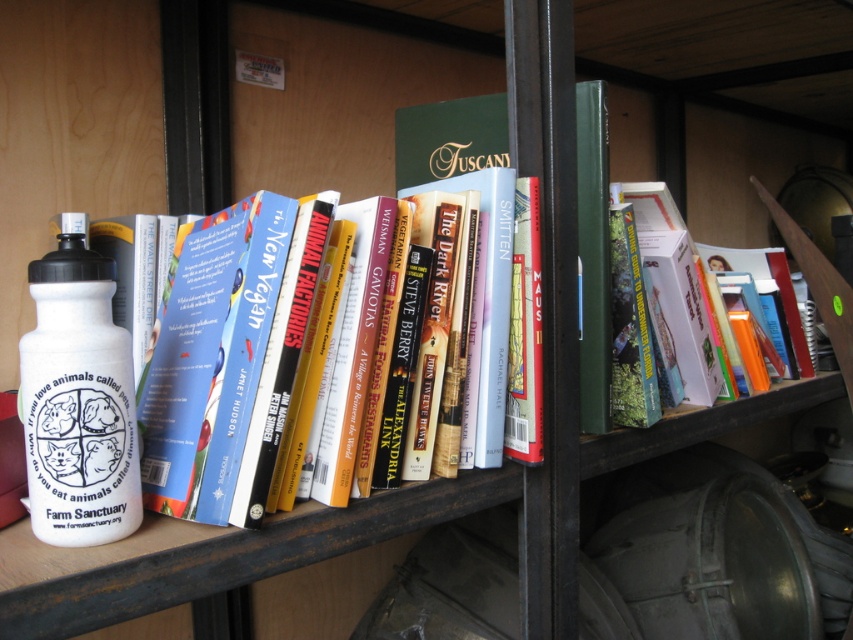
Who is lower down, white matte water bottle at left or green hardcover book at center?

white matte water bottle at left is lower down.

Who is positioned more to the left, white matte water bottle at left or green hardcover book at center?

white matte water bottle at left is more to the left.

Identify the location of white matte water bottle at left. The width and height of the screenshot is (853, 640). (78, 401).

Locate an element on the screen. white matte water bottle at left is located at coordinates (78, 401).

Who is taller, green hardcover book at center or hardcover book at center?

With more height is green hardcover book at center.

Is point (589, 104) farther from camera compared to point (524, 196)?

Yes, it is behind point (524, 196).

Is point (590, 408) closer to viewer compared to point (515, 182)?

No.

The image size is (853, 640). What are the coordinates of `green hardcover book at center` in the screenshot? It's located at (593, 256).

Does white matte water bottle at left have a greater height compared to hardcover book at center?

No, white matte water bottle at left is not taller than hardcover book at center.

Locate an element on the screen. This screenshot has width=853, height=640. white matte water bottle at left is located at coordinates (78, 401).